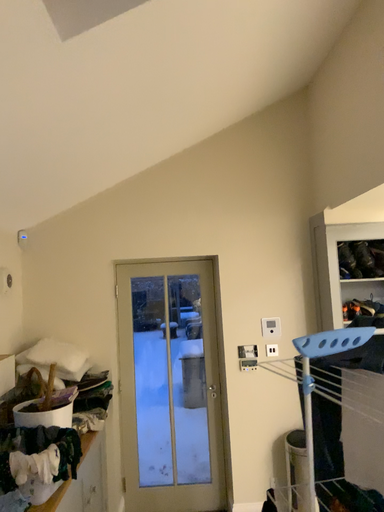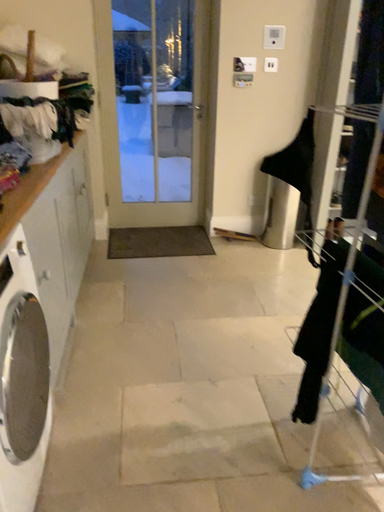
Question: How did the camera likely rotate when shooting the video?

Choices:
 (A) rotated upward
 (B) rotated downward

Answer: (B)